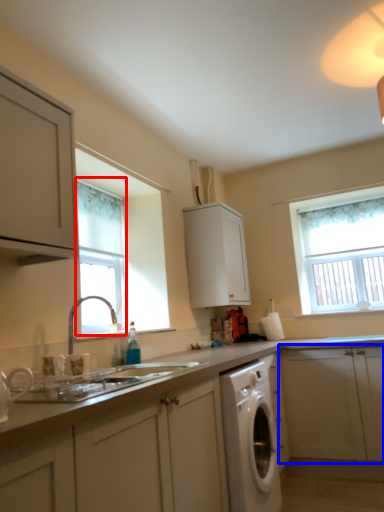
Question: Among these objects, which one is farthest to the camera, window (highlighted by a red box) or cabinetry (highlighted by a blue box)?

Choices:
 (A) window
 (B) cabinetry

Answer: (B)